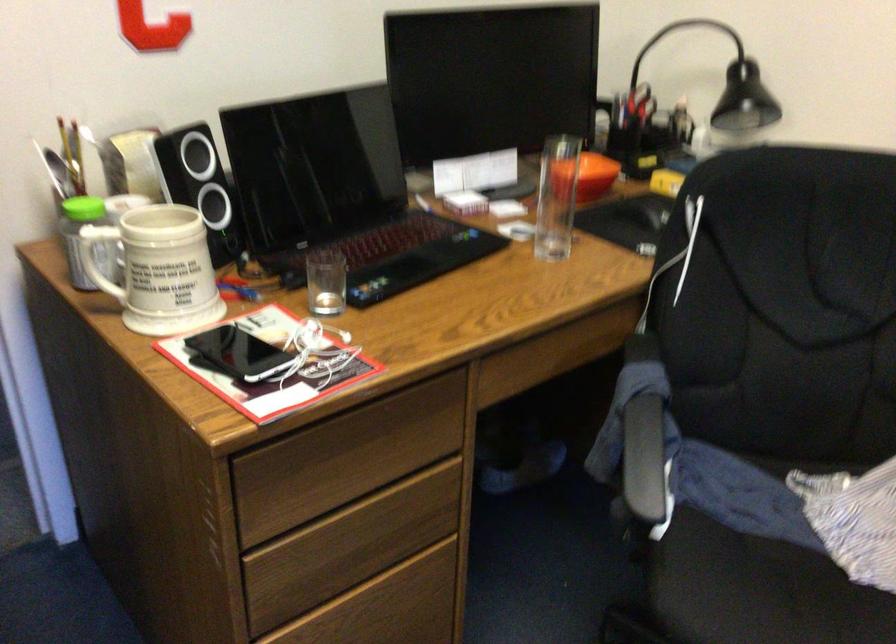
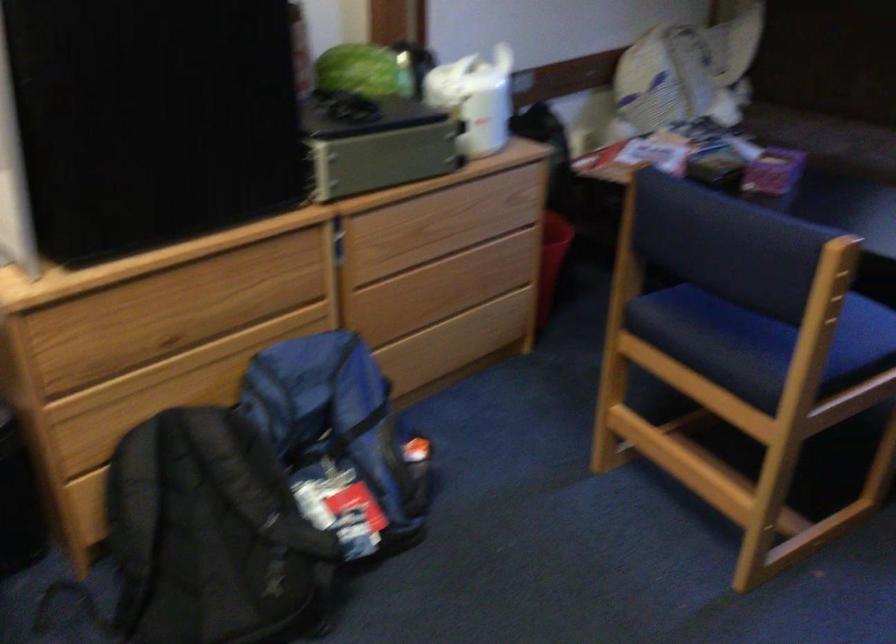
How did the camera likely rotate?

The rotation direction of the camera is right-down.